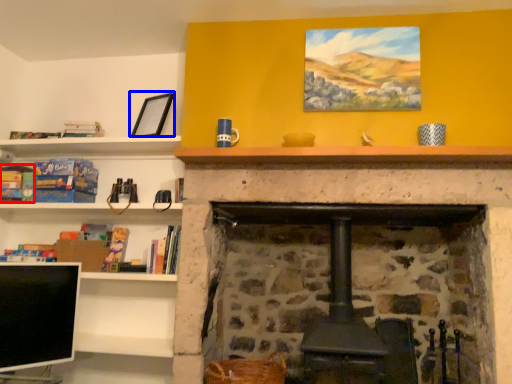
Question: Which object appears farthest to the camera in this image, book (highlighted by a red box) or picture frame (highlighted by a blue box)?

Choices:
 (A) book
 (B) picture frame

Answer: (A)